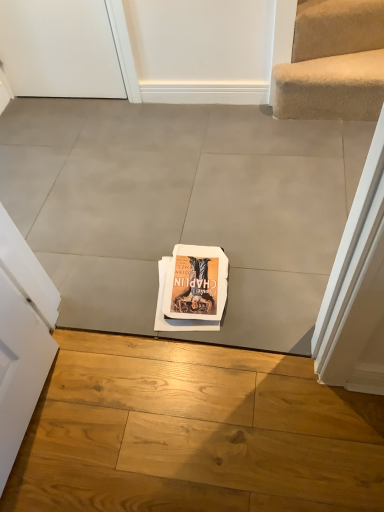
At what (x,y) coordinates should I click in order to perform the action: click on free space above gray concrete at center, which ranks as the 1th concrete in back-to-front order (from a real-world perspective). Please return your answer as a coordinate pair (x, y). This screenshot has height=512, width=384. Looking at the image, I should click on (135, 188).